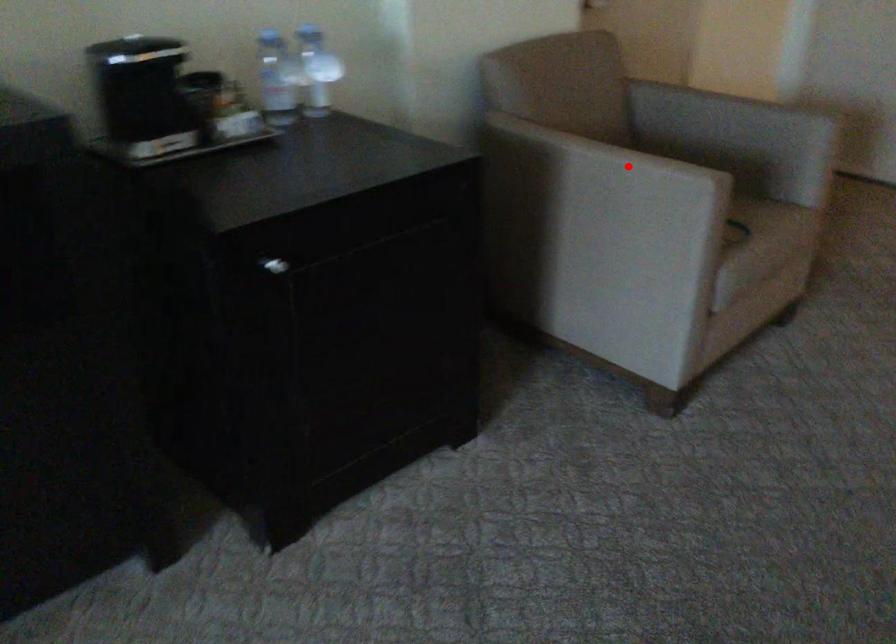
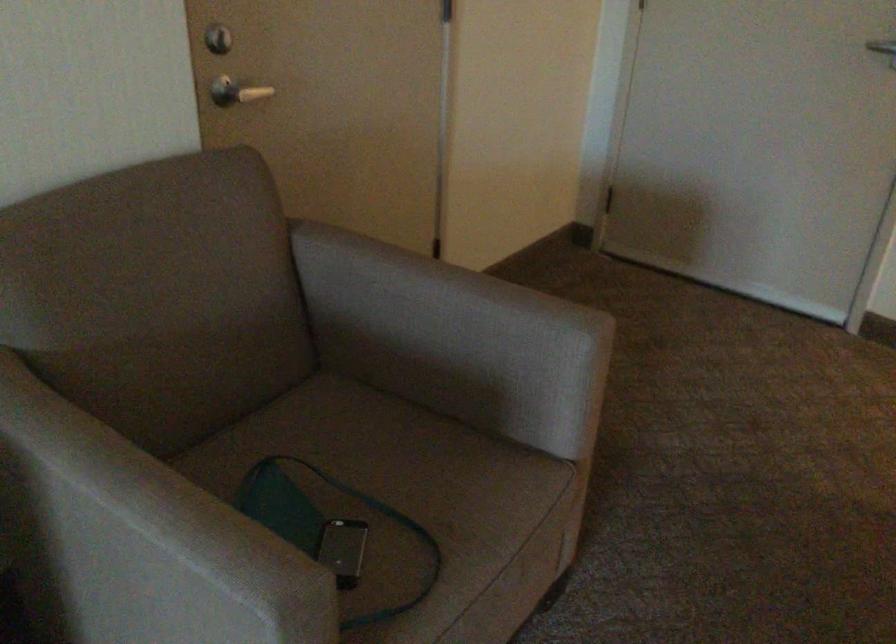
Question: I am providing you with two images of the same scene from different viewpoints. Given a red point in image1, look at the same physical point in image2. Is it:

Choices:
 (A) Closer to the viewpoint
 (B) Farther from the viewpoint

Answer: (A)